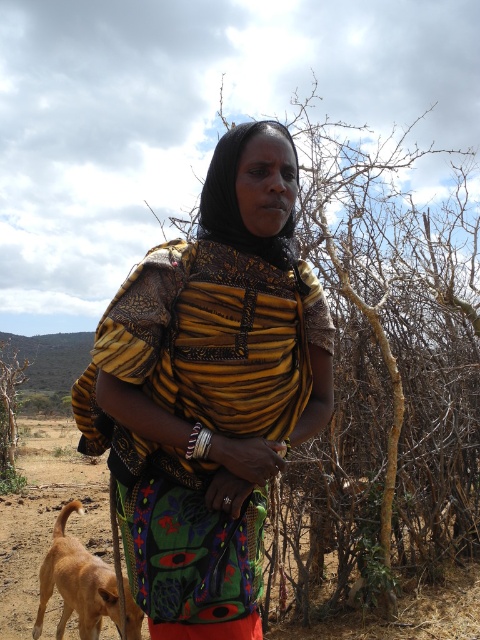
Can you confirm if yellow textured fabric at center is bigger than brown sandy dirt at lower left?

No, yellow textured fabric at center is not bigger than brown sandy dirt at lower left.

Is yellow textured fabric at center below brown sandy dirt at lower left?

No.

Is point (259, 371) positioned before point (99, 483)?

Yes, point (259, 371) is in front of point (99, 483).

Identify the location of yellow textured fabric at center. This screenshot has width=480, height=640. (210, 390).

Can you confirm if brown sandy dirt at lower left is wider than light brown fur at lower left?

Yes.

Can you confirm if brown sandy dirt at lower left is positioned to the right of light brown fur at lower left?

Incorrect, brown sandy dirt at lower left is not on the right side of light brown fur at lower left.

I want to click on brown sandy dirt at lower left, so click(46, 516).

Is yellow textured fabric at center to the left of light brown fur at lower left from the viewer's perspective?

In fact, yellow textured fabric at center is to the right of light brown fur at lower left.

What do you see at coordinates (210, 390) in the screenshot?
I see `yellow textured fabric at center` at bounding box center [210, 390].

I want to click on yellow textured fabric at center, so click(210, 390).